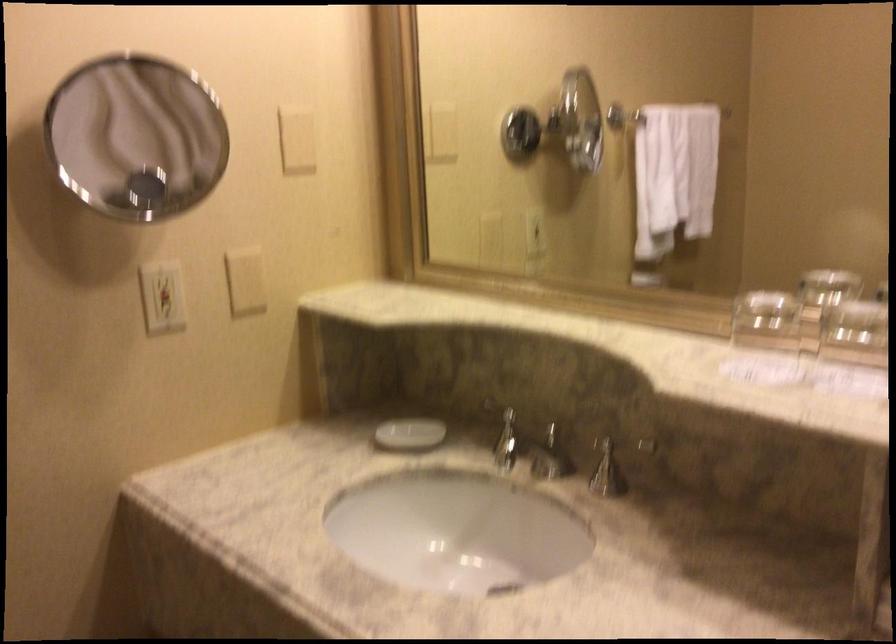
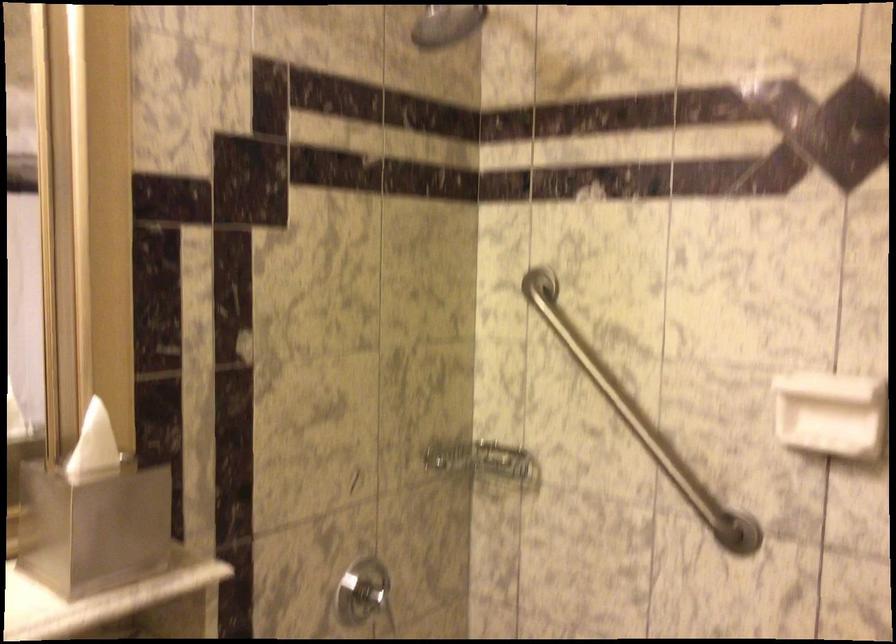
Question: Based on the continuous images, in which direction is the camera rotating? Reply with the corresponding letter.

Choices:
 (A) Left
 (B) Right
 (C) Up
 (D) Down

Answer: (B)